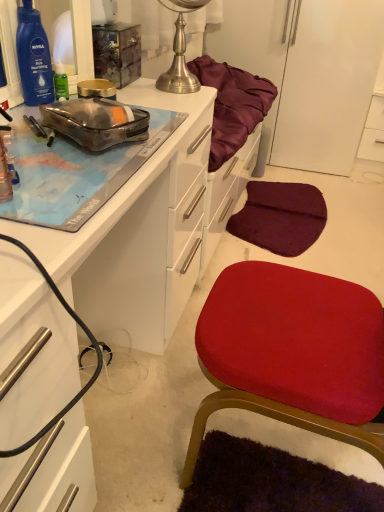
Where is `transparent plastic pouch at upper left`? Image resolution: width=384 pixels, height=512 pixels. transparent plastic pouch at upper left is located at coordinates (96, 122).

In order to face white glossy cabinet at upper right, which is counted as the first cabinetry, starting from the back, should I rotate leftwards or rightwards?

You should look right and rotate roughly 23.893 degrees.

Locate an element on the screen. The width and height of the screenshot is (384, 512). matte white desk at upper left, which is the 2th cabinetry in back-to-front order is located at coordinates (136, 234).

Image resolution: width=384 pixels, height=512 pixels. I want to click on chair lying on the right of transparent plastic pouch at upper left, so click(x=292, y=354).

Considering the sizes of objects velvet red cushion at center and transparent plastic pouch at upper left in the image provided, who is smaller, velvet red cushion at center or transparent plastic pouch at upper left?

transparent plastic pouch at upper left is smaller.

Which point is more forward, [267,265] or [80,131]?

Point [80,131]

Can we say velvet red cushion at center lies outside transparent plastic pouch at upper left?

velvet red cushion at center lies outside transparent plastic pouch at upper left's area.

Does transparent plastic pouch at upper left have a greater width compared to white glossy cabinet at upper right, the first cabinetry when ordered from top to bottom?

No.

Considering the points (75, 135) and (382, 154), which point is behind, point (75, 135) or point (382, 154)?

The point (382, 154) is farther.

Is white glossy cabinet at upper right, positioned as the 2th cabinetry in left-to-right order, a part of transparent plastic pouch at upper left?

Actually, white glossy cabinet at upper right, positioned as the 2th cabinetry in left-to-right order, is outside transparent plastic pouch at upper left.

Between matte white desk at upper left, the first cabinetry from the left, and transparent plastic pouch at upper left, which one appears on the left side from the viewer's perspective?

matte white desk at upper left, the first cabinetry from the left.

Based on their sizes in the image, would you say matte white desk at upper left, the 1th cabinetry when ordered from bottom to top, is bigger or smaller than transparent plastic pouch at upper left?

Clearly, matte white desk at upper left, the 1th cabinetry when ordered from bottom to top, is larger in size than transparent plastic pouch at upper left.

From the image's perspective, which one is positioned lower, matte white desk at upper left, the first cabinetry from the left, or transparent plastic pouch at upper left?

matte white desk at upper left, the first cabinetry from the left, appears lower in the image.

Does white glossy cabinet at upper right, positioned as the 2th cabinetry in left-to-right order, have a lesser height compared to matte white desk at upper left, which is the 2th cabinetry in top-to-bottom order?

Indeed, white glossy cabinet at upper right, positioned as the 2th cabinetry in left-to-right order, has a lesser height compared to matte white desk at upper left, which is the 2th cabinetry in top-to-bottom order.

Would you say white glossy cabinet at upper right, positioned as the 2th cabinetry in left-to-right order, is outside matte white desk at upper left, the 1th cabinetry when ordered from bottom to top?

Yes.

Does white glossy cabinet at upper right, positioned as the second cabinetry in front-to-back order, have a greater width compared to matte white desk at upper left, which is the 2th cabinetry in top-to-bottom order?

No.

Could you tell me if white glossy cabinet at upper right, positioned as the second cabinetry in front-to-back order, is turned towards matte white desk at upper left, the first cabinetry from the left?

No, white glossy cabinet at upper right, positioned as the second cabinetry in front-to-back order, is not turned towards matte white desk at upper left, the first cabinetry from the left.

Considering the positions of point (196, 4) and point (10, 484), is point (196, 4) closer or farther from the camera than point (10, 484)?

Point (196, 4) is positioned farther from the camera compared to point (10, 484).

In order to click on cabinetry located on the left of brushed metal globe at upper center in this screenshot , I will do `click(136, 234)`.

From the image's perspective, which one is positioned lower, brushed metal globe at upper center or matte white desk at upper left, the first cabinetry from the left?

matte white desk at upper left, the first cabinetry from the left, appears lower in the image.

Considering the relative sizes of transparent plastic pouch at upper left and velvet red cushion at center in the image provided, is transparent plastic pouch at upper left bigger than velvet red cushion at center?

No.

Could you tell me if transparent plastic pouch at upper left is turned towards velvet red cushion at center?

Yes, transparent plastic pouch at upper left is aimed at velvet red cushion at center.

Is transparent plastic pouch at upper left far from velvet red cushion at center?

No, there isn't a large distance between transparent plastic pouch at upper left and velvet red cushion at center.

From the image's perspective, is transparent plastic pouch at upper left located above or below velvet red cushion at center?

Based on their image positions, transparent plastic pouch at upper left is located above velvet red cushion at center.

Is transparent plastic pouch at upper left taller than brushed metal globe at upper center?

In fact, transparent plastic pouch at upper left may be shorter than brushed metal globe at upper center.

Considering the sizes of transparent plastic pouch at upper left and brushed metal globe at upper center in the image, is transparent plastic pouch at upper left bigger or smaller than brushed metal globe at upper center?

In the image, transparent plastic pouch at upper left appears to be smaller than brushed metal globe at upper center.

How different are the orientations of transparent plastic pouch at upper left and brushed metal globe at upper center in degrees?

There is a 25.8-degree angle between the facing directions of transparent plastic pouch at upper left and brushed metal globe at upper center.

This screenshot has width=384, height=512. Identify the location of chair lying below the transparent plastic pouch at upper left (from the image's perspective). (292, 354).

Where is `appliance on the left of white glossy cabinet at upper right, positioned as the 2th cabinetry in left-to-right order`? The height and width of the screenshot is (512, 384). appliance on the left of white glossy cabinet at upper right, positioned as the 2th cabinetry in left-to-right order is located at coordinates (96, 122).

Estimate the real-world distances between objects in this image. Which object is further from matte white desk at upper left, the 1th cabinetry when ordered from bottom to top, white glossy cabinet at upper right, marked as the 1th cabinetry in a right-to-left arrangement, or brushed metal globe at upper center?

Based on the image, white glossy cabinet at upper right, marked as the 1th cabinetry in a right-to-left arrangement, appears to be further to matte white desk at upper left, the 1th cabinetry when ordered from bottom to top.

In the scene shown: Which object lies nearer to the anchor point velvet red cushion at center, brushed metal globe at upper center or matte white desk at upper left, the first cabinetry from the left?

The object closer to velvet red cushion at center is matte white desk at upper left, the first cabinetry from the left.

When comparing their distances from white glossy cabinet at upper right, the first cabinetry when ordered from top to bottom, does velvet red cushion at center or matte white desk at upper left, the 1th cabinetry when ordered from bottom to top, seem closer?

Based on the image, matte white desk at upper left, the 1th cabinetry when ordered from bottom to top, appears to be nearer to white glossy cabinet at upper right, the first cabinetry when ordered from top to bottom.

Which object lies nearer to the anchor point velvet red cushion at center, white glossy cabinet at upper right, which is counted as the first cabinetry, starting from the back, or matte white desk at upper left, which is the 2th cabinetry in back-to-front order?

Among the two, matte white desk at upper left, which is the 2th cabinetry in back-to-front order, is located nearer to velvet red cushion at center.

Considering their positions, is velvet red cushion at center positioned closer to transparent plastic pouch at upper left than white glossy cabinet at upper right, positioned as the second cabinetry in front-to-back order?

velvet red cushion at center lies closer to transparent plastic pouch at upper left than the other object.

From the image, which object appears to be nearer to white glossy cabinet at upper right, marked as the 1th cabinetry in a right-to-left arrangement, matte white desk at upper left, the first cabinetry from the left, or velvet red cushion at center?

Among the two, matte white desk at upper left, the first cabinetry from the left, is located nearer to white glossy cabinet at upper right, marked as the 1th cabinetry in a right-to-left arrangement.

Looking at the image, which one is located closer to matte white desk at upper left, the 1th cabinetry when ordered from bottom to top, velvet red cushion at center or brushed metal globe at upper center?

velvet red cushion at center is closer to matte white desk at upper left, the 1th cabinetry when ordered from bottom to top.

Looking at this image, estimate the real-world distances between objects in this image. Which object is closer to white glossy cabinet at upper right, marked as the 1th cabinetry in a right-to-left arrangement, transparent plastic pouch at upper left or brushed metal globe at upper center?

brushed metal globe at upper center is positioned closer to the anchor white glossy cabinet at upper right, marked as the 1th cabinetry in a right-to-left arrangement.

Where is `cabinetry that lies between brushed metal globe at upper center and velvet red cushion at center from top to bottom`? The height and width of the screenshot is (512, 384). cabinetry that lies between brushed metal globe at upper center and velvet red cushion at center from top to bottom is located at coordinates (136, 234).

Locate an element on the screen. The image size is (384, 512). chair between matte white desk at upper left, which is the 2th cabinetry in top-to-bottom order, and white glossy cabinet at upper right, positioned as the 2th cabinetry in left-to-right order, from front to back is located at coordinates (292, 354).

This screenshot has width=384, height=512. Identify the location of appliance located between matte white desk at upper left, which is the 2th cabinetry in top-to-bottom order, and brushed metal globe at upper center in the depth direction. (96, 122).

Image resolution: width=384 pixels, height=512 pixels. I want to click on lamp between matte white desk at upper left, which is counted as the first cabinetry, starting from the front, and white glossy cabinet at upper right, positioned as the second cabinetry in front-to-back order, along the z-axis, so click(x=180, y=51).